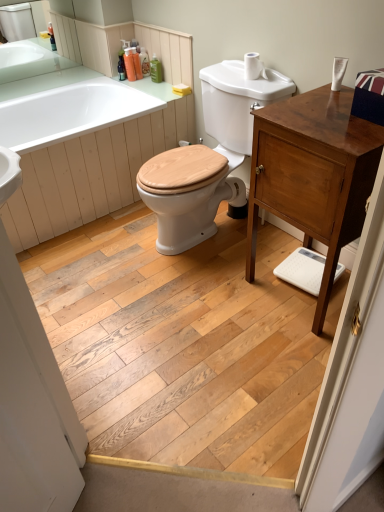
The image size is (384, 512). What are the coordinates of `vacant space underneath natural wood screen door at lower left (from a real-world perspective)` in the screenshot? It's located at (61, 323).